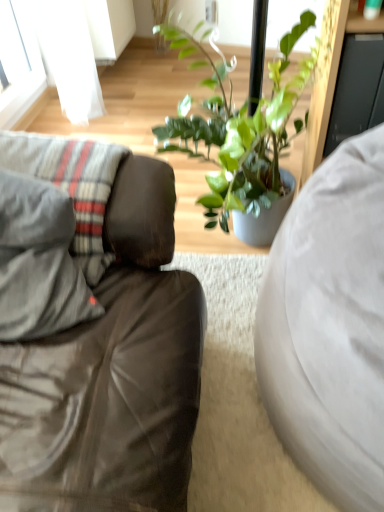
Question: Does point (107, 176) appear closer or farther from the camera than point (319, 316)?

Choices:
 (A) closer
 (B) farther

Answer: (B)

Question: Considering the relative positions of gray fabric pillow at left and white fabric studio couch at right, which is counted as the second studio couch, starting from the left, in the image provided, is gray fabric pillow at left to the left or to the right of white fabric studio couch at right, which is counted as the second studio couch, starting from the left,?

Choices:
 (A) left
 (B) right

Answer: (A)

Question: Which is farther from the gray fabric pillow at left?

Choices:
 (A) white fabric studio couch at right, which is the first studio couch in right-to-left order
 (B) matte gray couch at left, which appears as the 2th studio couch when viewed from the right

Answer: (A)

Question: Estimate the real-world distances between objects in this image. Which object is closer to the white fabric studio couch at right, which is counted as the second studio couch, starting from the left?

Choices:
 (A) gray fabric pillow at left
 (B) matte gray couch at left, which appears as the 2th studio couch when viewed from the right

Answer: (B)